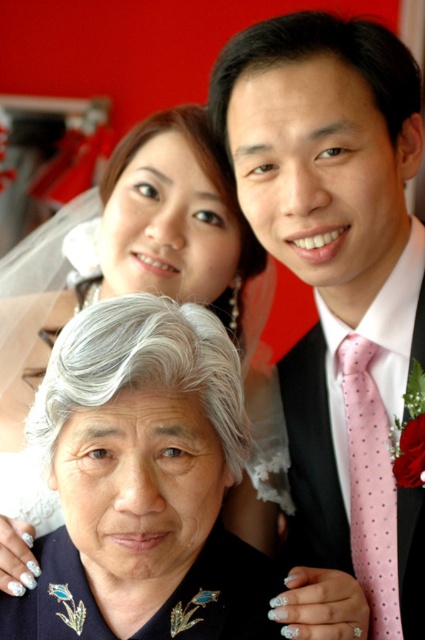
Can you confirm if pink dotted tie at center is bigger than pink dotted tie at right?

Correct, pink dotted tie at center is larger in size than pink dotted tie at right.

Who is more distant from viewer, (351, 548) or (374, 616)?

Point (351, 548)

Where is `pink dotted tie at center`? pink dotted tie at center is located at coordinates (337, 276).

Where is `pink dotted tie at center`? pink dotted tie at center is located at coordinates (337, 276).

Does gray fabric at lower left have a greater height compared to pink dotted tie at right?

Indeed, gray fabric at lower left has a greater height compared to pink dotted tie at right.

Which is above, gray fabric at lower left or pink dotted tie at right?

gray fabric at lower left is higher up.

Who is more forward, (17, 417) or (360, 424)?

Positioned in front is point (360, 424).

Where is `gray fabric at lower left`? This screenshot has width=425, height=640. gray fabric at lower left is located at coordinates (156, 237).

Does pink dotted tie at center have a larger size compared to gray fabric at lower left?

No, pink dotted tie at center is not bigger than gray fabric at lower left.

Who is more forward, (x=280, y=51) or (x=218, y=168)?

Point (x=280, y=51) is in front.

Is point (320, 417) positioned before point (173, 227)?

Yes, it is in front of point (173, 227).

The image size is (425, 640). Find the location of `pink dotted tie at center`. pink dotted tie at center is located at coordinates [x=337, y=276].